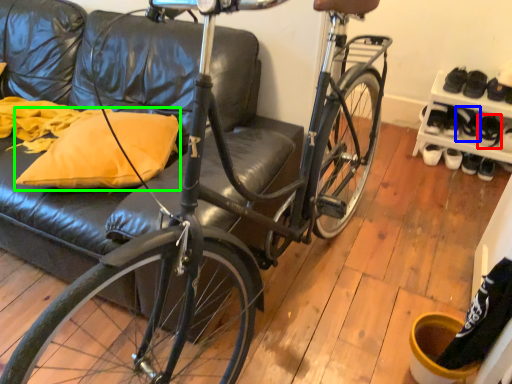
Question: Which is nearer to the shoe (highlighted by a red box)? shoe (highlighted by a blue box) or throw pillow (highlighted by a green box).

Choices:
 (A) shoe
 (B) throw pillow

Answer: (A)